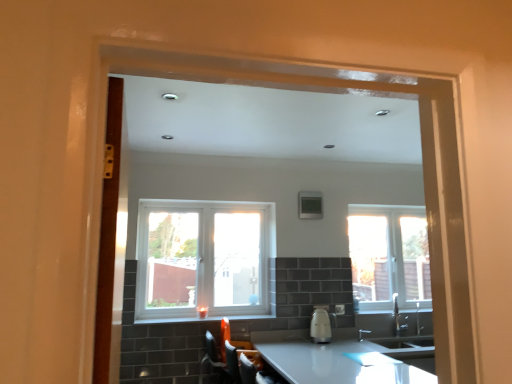
Question: Does white glossy kettle at center appear on the left side of white plastic window at center, arranged as the first window when viewed from the left?

Choices:
 (A) no
 (B) yes

Answer: (A)

Question: Does white glossy kettle at center have a greater width compared to white plastic window at center, which ranks as the 2th window in back-to-front order?

Choices:
 (A) no
 (B) yes

Answer: (B)

Question: Can you confirm if white glossy kettle at center is smaller than white plastic window at center, arranged as the 2th window when viewed from the right?

Choices:
 (A) yes
 (B) no

Answer: (A)

Question: Is white glossy kettle at center completely or partially outside of white plastic window at center, the first window positioned from the front?

Choices:
 (A) no
 (B) yes

Answer: (B)

Question: Is white glossy kettle at center at the right side of white plastic window at center, arranged as the first window when viewed from the left?

Choices:
 (A) no
 (B) yes

Answer: (B)

Question: Is point (361, 365) positioned closer to the camera than point (159, 322)?

Choices:
 (A) closer
 (B) farther

Answer: (A)

Question: From the image's perspective, is white glossy countertop at lower center above or below white glossy window sill at center?

Choices:
 (A) below
 (B) above

Answer: (A)

Question: Is white glossy countertop at lower center bigger or smaller than white glossy window sill at center?

Choices:
 (A) big
 (B) small

Answer: (A)

Question: Relative to white glossy window sill at center, is white glossy countertop at lower center in front or behind?

Choices:
 (A) behind
 (B) front

Answer: (B)

Question: Choose the correct answer: Is white glossy countertop at lower center inside clear glass window at right, which appears as the 1th window when viewed from the right, or outside it?

Choices:
 (A) outside
 (B) inside

Answer: (A)

Question: In terms of width, does white glossy countertop at lower center look wider or thinner when compared to clear glass window at right, the second window viewed from the front?

Choices:
 (A) thin
 (B) wide

Answer: (B)

Question: Is point (392, 375) positioned closer to the camera than point (386, 304)?

Choices:
 (A) farther
 (B) closer

Answer: (B)

Question: Considering the positions of white glossy countertop at lower center and clear glass window at right, which ranks as the 1th window in back-to-front order, in the image, is white glossy countertop at lower center bigger or smaller than clear glass window at right, which ranks as the 1th window in back-to-front order,?

Choices:
 (A) big
 (B) small

Answer: (A)

Question: Is clear glass window at right, which ranks as the second window in left-to-right order, in front of or behind white glossy kettle at center in the image?

Choices:
 (A) behind
 (B) front

Answer: (A)

Question: Considering the relative positions of clear glass window at right, which appears as the 1th window when viewed from the right, and white glossy kettle at center in the image provided, is clear glass window at right, which appears as the 1th window when viewed from the right, to the left or to the right of white glossy kettle at center?

Choices:
 (A) right
 (B) left

Answer: (A)